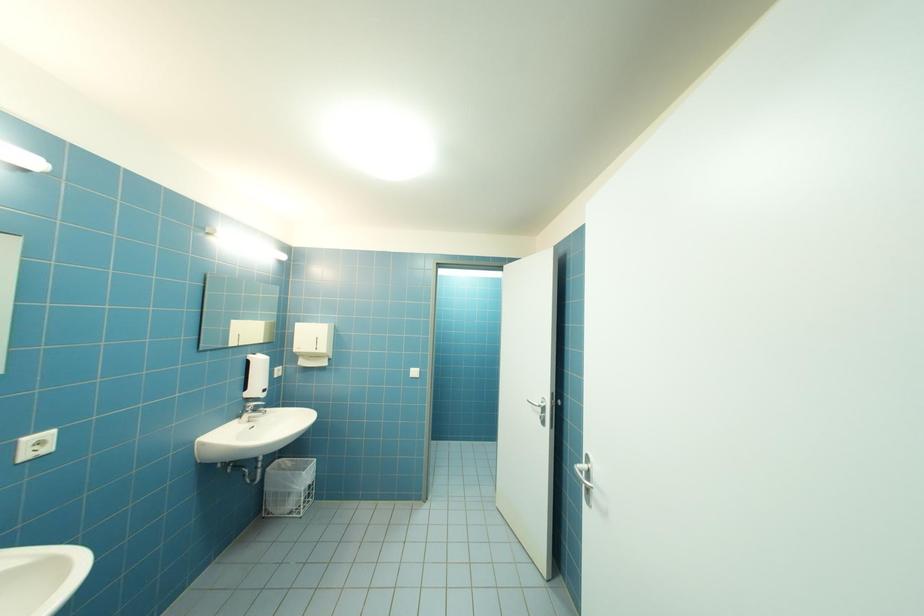
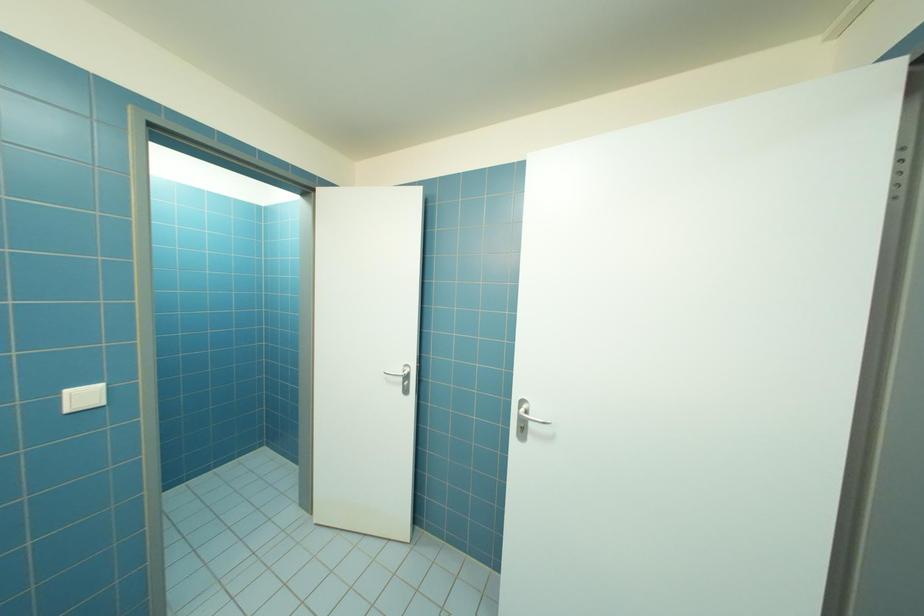
Question: The camera is either moving clockwise (left) or counter-clockwise (right) around the object. The first image is from the beginning of the video and the second image is from the end. Is the camera moving left or right when shooting the video?

Choices:
 (A) Left
 (B) Right

Answer: (A)